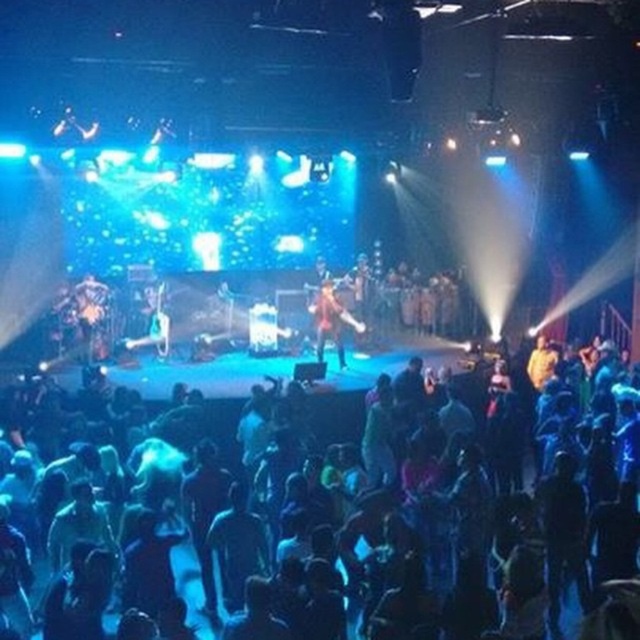
You are a photographer at the concert. You want to take a photo of the shiny red jacket at center without the black matte crowd at lower left blocking it. Which direction should you move your camera to avoid the crowd?

You should move your camera to the left to avoid the black matte crowd at lower left, since the black matte crowd at lower left is to the right of the shiny red jacket at center.

You are a photographer at the concert and want to capture a photo that includes both the black matte crowd at lower left and the shiny red jacket at center. Which object should you focus on first to ensure both are in frame?

The black matte crowd at lower left occupies less space than the shiny red jacket at center, so you should focus on the shiny red jacket at center first to ensure both fit in the frame.